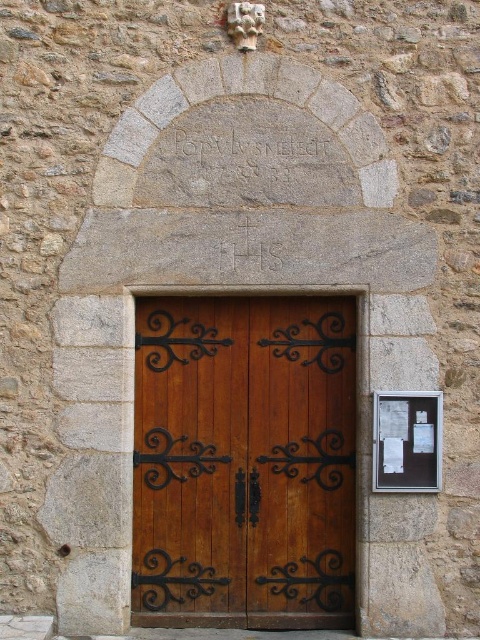
You are a visitor arriving at the historic stone building. You notice the carved stone inscription at center and the white paper noticeboard at right. Which object is positioned higher in the scene?

The carved stone inscription at center is positioned higher than the white paper noticeboard at right.

Based on the photo, you are standing at the entrance of the historic building and want to read both the carved stone inscription at center and the white paper noticeboard at right. Which one do you need to step closer to in order to read?

You need to step closer to the white paper noticeboard at right because the carved stone inscription at center is already closer to you, so it is further away than the noticeboard.